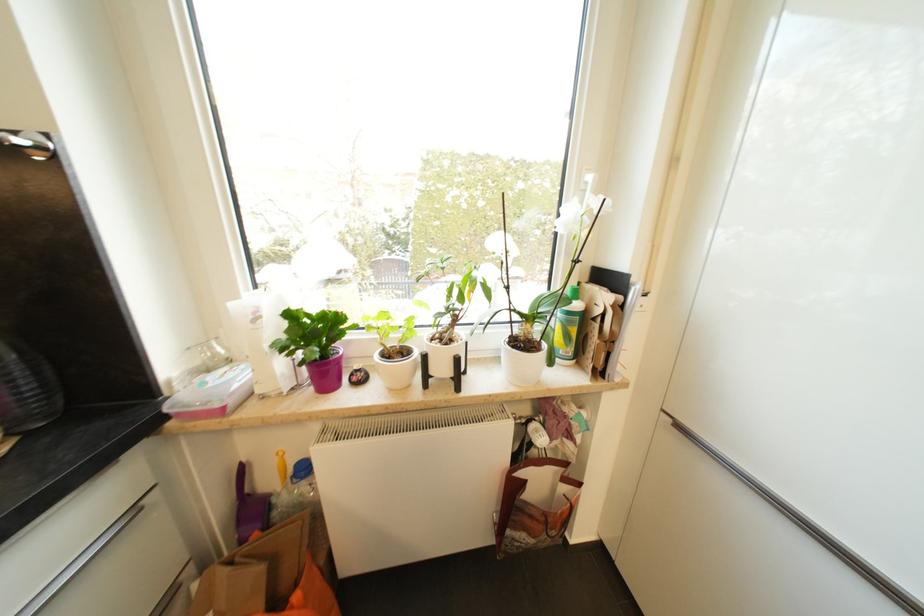
Image resolution: width=924 pixels, height=616 pixels. Describe the element at coordinates (300, 469) in the screenshot. I see `the blue bottle cap` at that location.